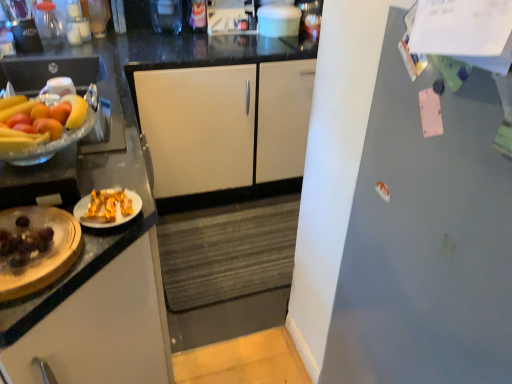
Question: Is shiny brown chocolate at left positioned before white matte cabinet at center, which is the 2th cabinetry in front-to-back order?

Choices:
 (A) no
 (B) yes

Answer: (B)

Question: From a real-world perspective, is shiny brown chocolate at left positioned over white matte cabinet at center, marked as the first cabinetry in a top-to-bottom arrangement, based on gravity?

Choices:
 (A) yes
 (B) no

Answer: (A)

Question: Is shiny brown chocolate at left at the left side of white matte cabinet at center, which is the 2th cabinetry in front-to-back order?

Choices:
 (A) no
 (B) yes

Answer: (B)

Question: From a real-world perspective, is shiny brown chocolate at left positioned under white matte cabinet at center, which is the 2th cabinetry in front-to-back order, based on gravity?

Choices:
 (A) no
 (B) yes

Answer: (A)

Question: Does shiny brown chocolate at left have a smaller size compared to white matte cabinet at center, which ranks as the first cabinetry in back-to-front order?

Choices:
 (A) yes
 (B) no

Answer: (A)

Question: Is shiny brown chocolate at left completely or partially outside of white matte cabinet at center, marked as the first cabinetry in a top-to-bottom arrangement?

Choices:
 (A) yes
 (B) no

Answer: (A)

Question: Does yellow matte grapefruit at left have a lesser width compared to white glossy plate at left, which is the second cabinetry from back to front?

Choices:
 (A) yes
 (B) no

Answer: (A)

Question: Is yellow matte grapefruit at left in front of white glossy plate at left, which ranks as the 2th cabinetry in top-to-bottom order?

Choices:
 (A) no
 (B) yes

Answer: (A)

Question: Considering the relative sizes of yellow matte grapefruit at left and white glossy plate at left, the first cabinetry when ordered from front to back, in the image provided, is yellow matte grapefruit at left shorter than white glossy plate at left, the first cabinetry when ordered from front to back,?

Choices:
 (A) no
 (B) yes

Answer: (B)

Question: Is yellow matte grapefruit at left positioned behind white glossy plate at left, the first cabinetry when ordered from front to back?

Choices:
 (A) yes
 (B) no

Answer: (A)

Question: Is yellow matte grapefruit at left to the right of white glossy plate at left, which ranks as the 2th cabinetry in top-to-bottom order, from the viewer's perspective?

Choices:
 (A) no
 (B) yes

Answer: (B)

Question: From a real-world perspective, does yellow matte grapefruit at left stand above white glossy plate at left, which is the second cabinetry from back to front?

Choices:
 (A) no
 (B) yes

Answer: (B)

Question: Is gray matte refrigerator at right positioned behind white matte cabinet at center, which is counted as the second cabinetry, starting from the bottom?

Choices:
 (A) no
 (B) yes

Answer: (A)